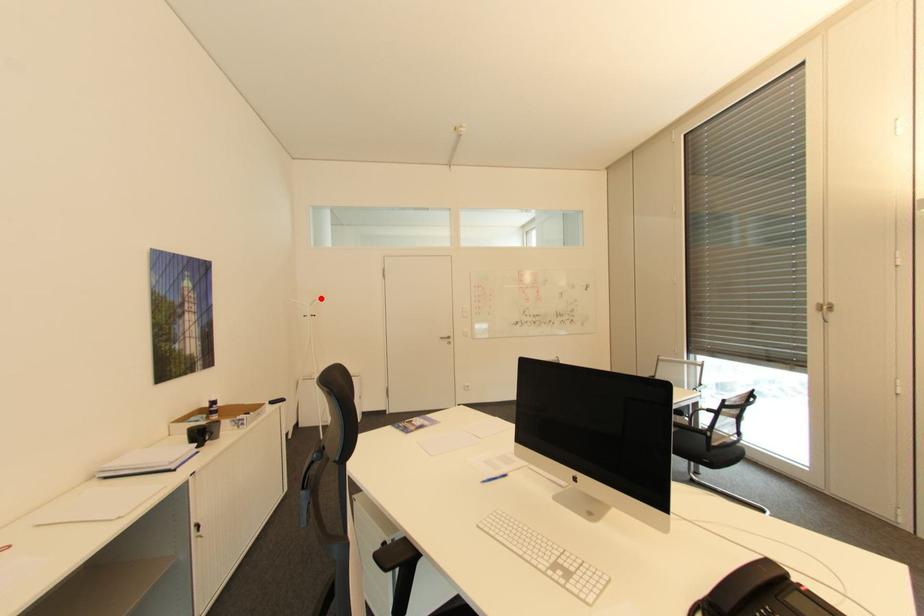
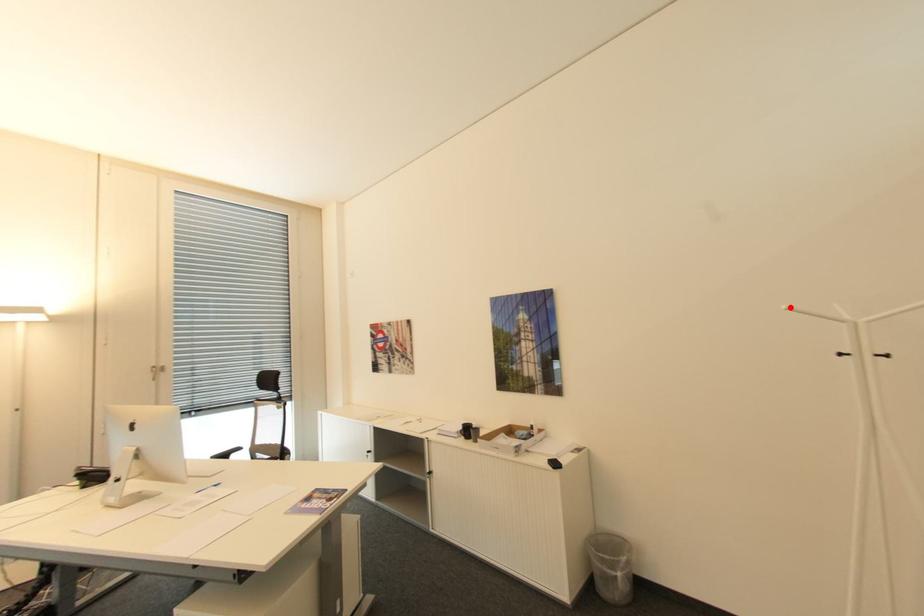
I am providing you with two images of the same scene from different viewpoints. A red point is marked on the first image and another point is marked on the second image. Does the point marked in image1 correspond to the same location as the one in image2?

Yes